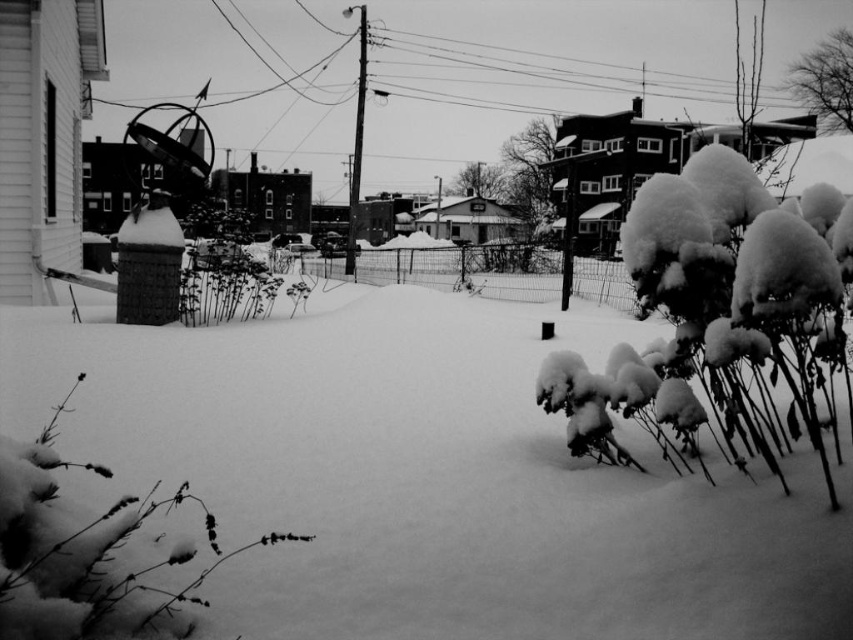
You are standing in the snowy urban scene shown in the image. You notice two points marked on the ground, one at coordinates point [820,253] and another at point [22,445]. Which of these points is closer to your current position?

Point [820,253] is closer to the camera than point [22,445], so the point at coordinates point [820,253] is closer to your current position.

You are standing at the center of the snowy urban scene. There is a point marked at coordinates [717,312]. What object is located at this point?

The point at [717,312] marks a fuzzy snow covered bush at right.